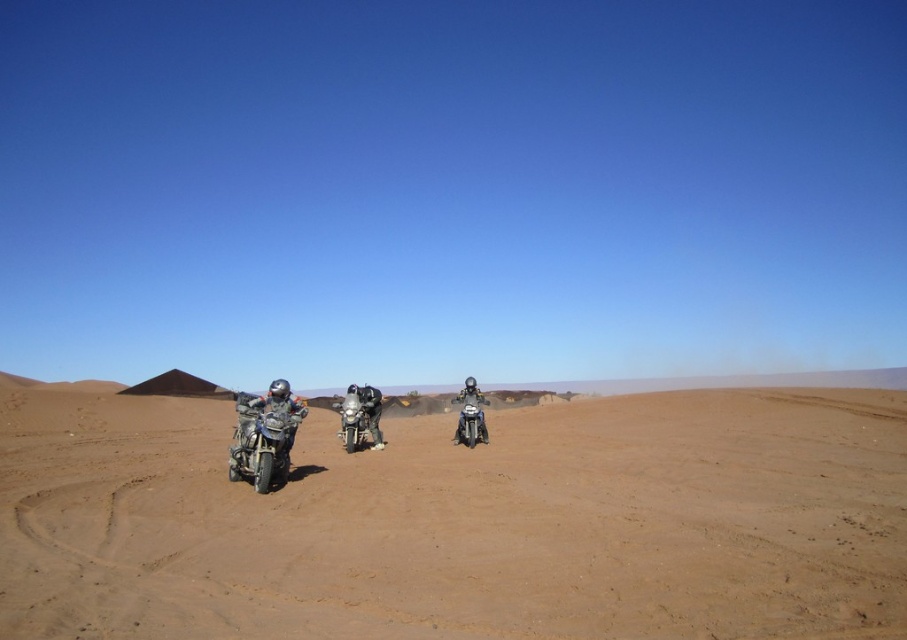
Question: Does brown sandy dirt at center appear on the right side of brushed metal motorcycle at left?

Choices:
 (A) yes
 (B) no

Answer: (B)

Question: Which object is the closest to the matte black motorcycle at center?

Choices:
 (A) brown sandy dirt at center
 (B) metallic silver motorcycle at center
 (C) metallic silver motorcycle at left
 (D) brushed metal motorcycle at left

Answer: (B)

Question: Which object is the farthest from the brown sandy dirt at center?

Choices:
 (A) metallic silver motorcycle at center
 (B) metallic silver motorcycle at left

Answer: (B)

Question: Does brown sandy dirt at center have a larger size compared to metallic silver motorcycle at center?

Choices:
 (A) yes
 (B) no

Answer: (A)

Question: Which is farther from the brown sandy dirt at center?

Choices:
 (A) metallic silver motorcycle at center
 (B) matte black motorcycle at center
 (C) metallic silver motorcycle at left

Answer: (C)

Question: Can you confirm if brown sandy dirt at center is thinner than brushed metal motorcycle at left?

Choices:
 (A) yes
 (B) no

Answer: (B)